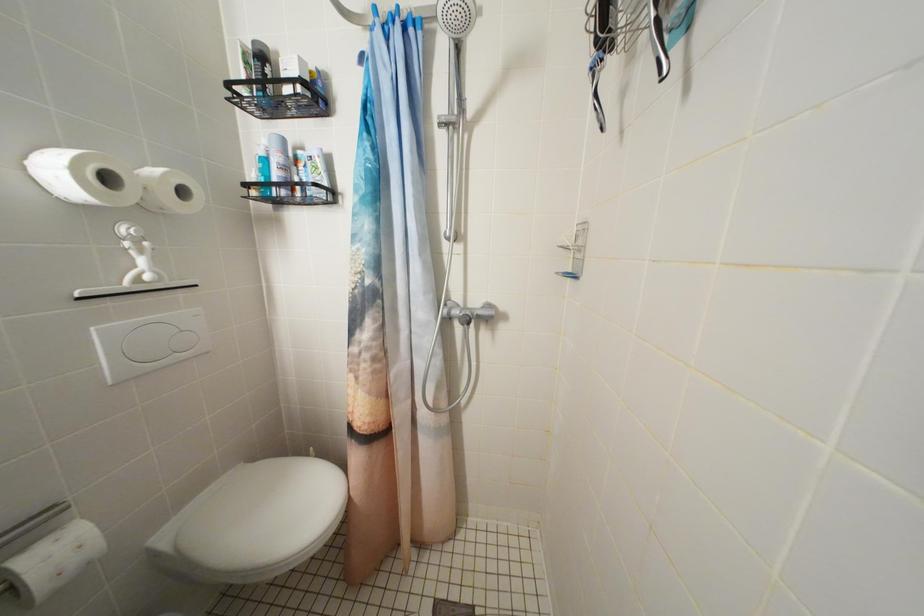
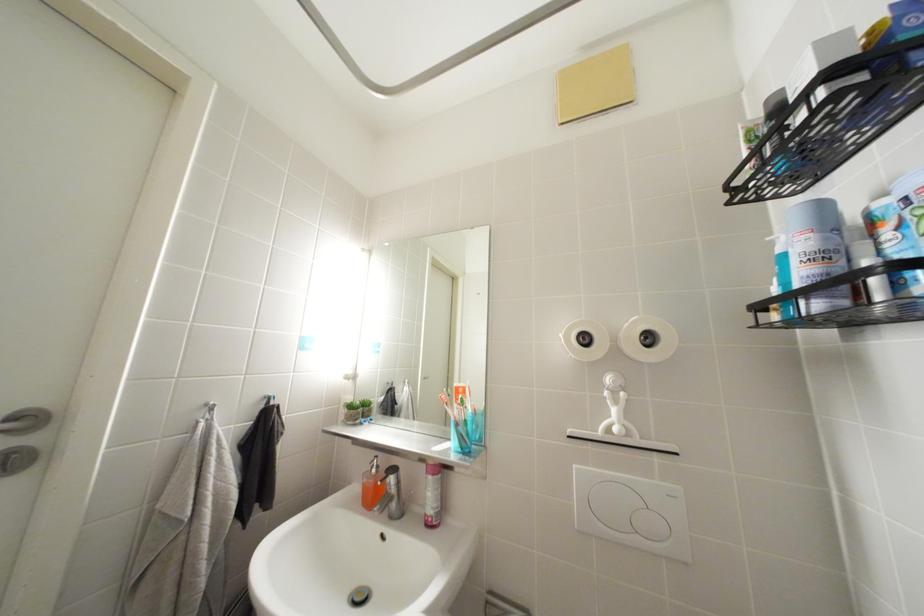
Question: How did the camera likely rotate?

Choices:
 (A) Left
 (B) Right
 (C) Up
 (D) Down

Answer: (A)